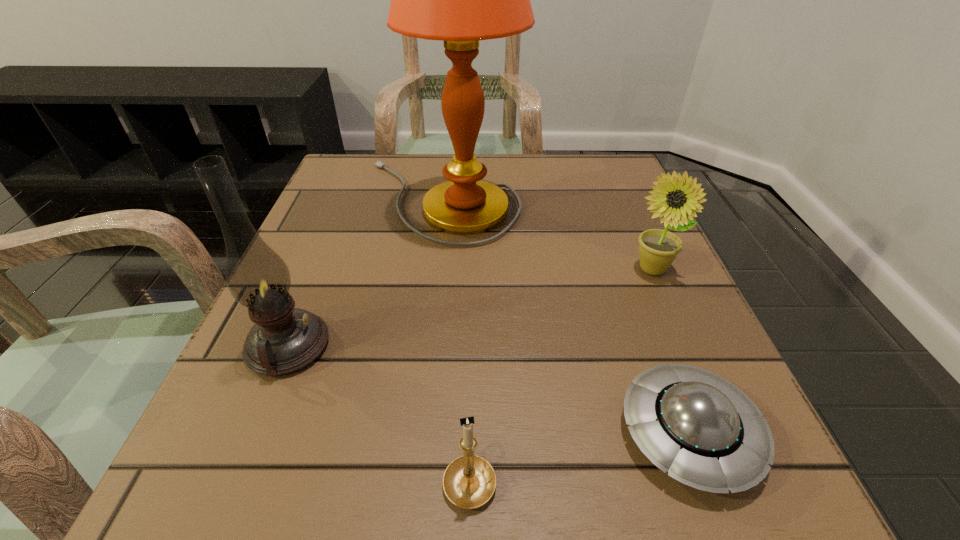
Image resolution: width=960 pixels, height=540 pixels. I want to click on saucer present at the right edge, so click(704, 431).

What are the coordinates of `object present at the far left corner` in the screenshot? It's located at click(460, 0).

The image size is (960, 540). I want to click on object at the near right corner, so click(704, 431).

In the image, there is a desktop. Find the location of `vacant region at the far edge`. vacant region at the far edge is located at coordinates (490, 170).

Image resolution: width=960 pixels, height=540 pixels. What are the coordinates of `blank area at the near edge` in the screenshot? It's located at (344, 488).

The width and height of the screenshot is (960, 540). In order to click on vacant space at the left edge in this screenshot , I will do `click(324, 268)`.

In the image, there is a desktop. At what (x,y) coordinates should I click in order to perform the action: click on vacant space at the right edge. Please return your answer as a coordinate pair (x, y). Looking at the image, I should click on (625, 343).

Locate an element on the screen. The image size is (960, 540). free space at the far left corner is located at coordinates (396, 188).

At what (x,y) coordinates should I click in order to perform the action: click on vacant space at the near left corner of the desktop. Please return your answer as a coordinate pair (x, y). The image size is (960, 540). Looking at the image, I should click on (186, 525).

The image size is (960, 540). Find the location of `free spot at the far right corner of the desktop`. free spot at the far right corner of the desktop is located at coordinates (609, 187).